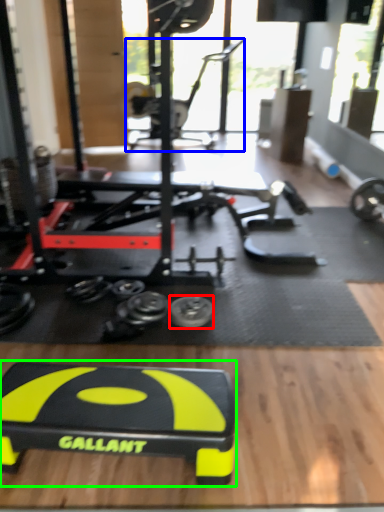
Question: Which object is the closest to the tire (highlighted by a red box)? Choose among these: sport equipment (highlighted by a blue box) or sport equipment (highlighted by a green box).

Choices:
 (A) sport equipment
 (B) sport equipment

Answer: (B)